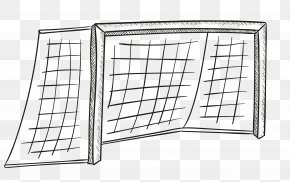
Locate an element on the screen. Image resolution: width=290 pixels, height=182 pixels. the bottom ends of the two frames in the middle to the right hand side is located at coordinates (94, 160), (259, 134).